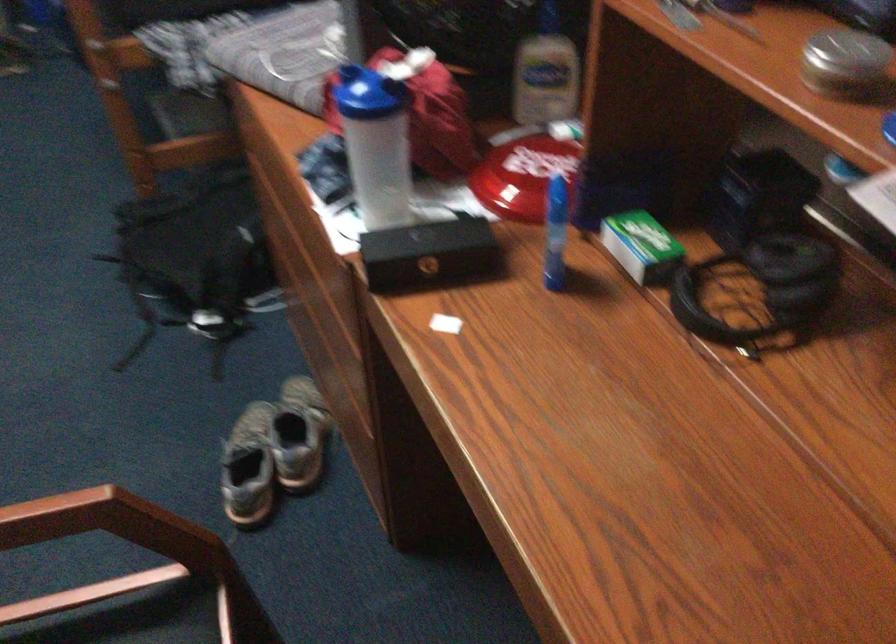
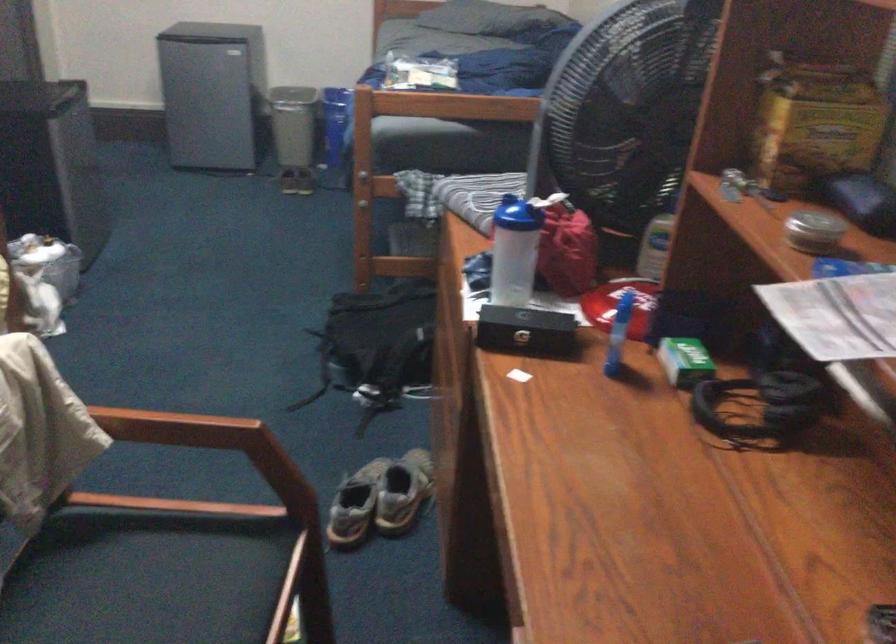
In the second image, find the point that corresponds to point 382,147 in the first image.

(513, 251)